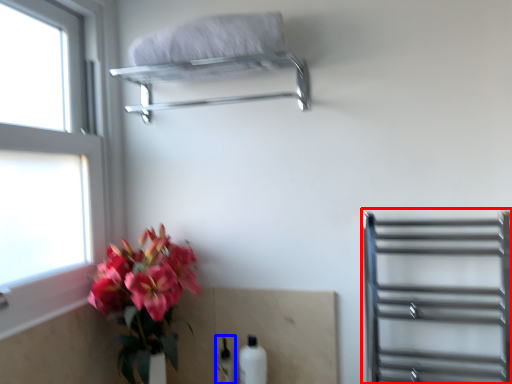
Question: Which object appears farthest to the camera in this image, shelf (highlighted by a red box) or bottle (highlighted by a blue box)?

Choices:
 (A) shelf
 (B) bottle

Answer: (B)